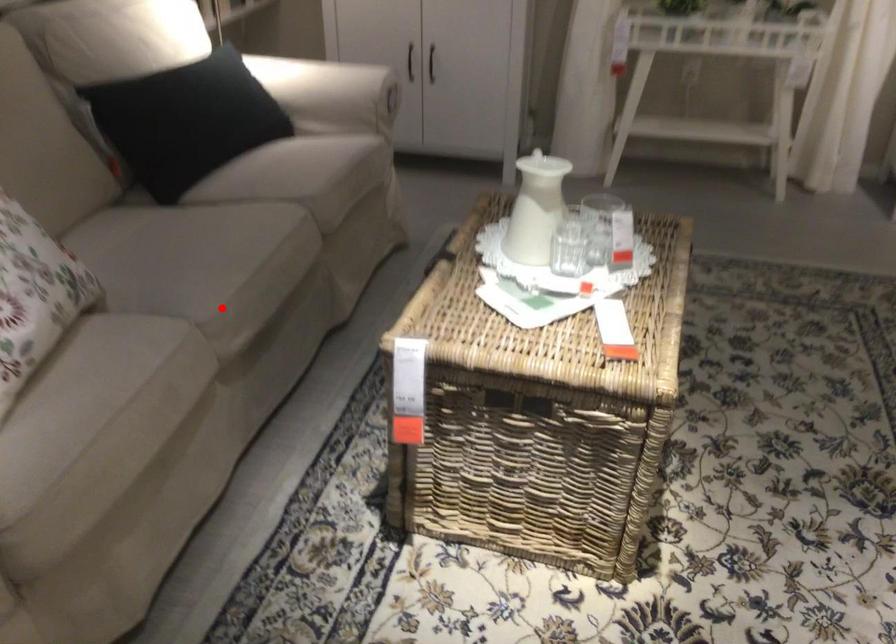
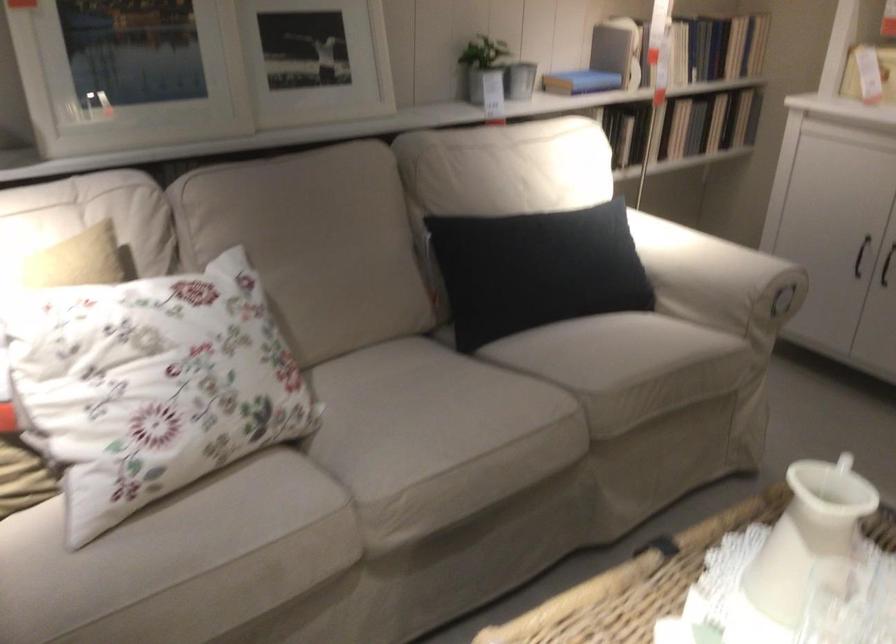
In the second image, find the point that corresponds to the highlighted location in the first image.

(398, 494)